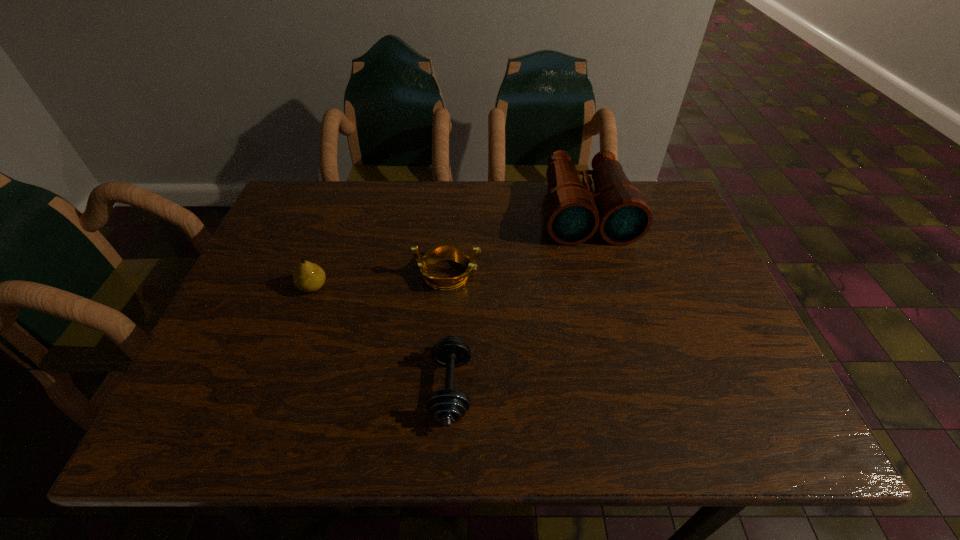
Where is `object that is at the far edge`? This screenshot has height=540, width=960. object that is at the far edge is located at coordinates (573, 213).

Image resolution: width=960 pixels, height=540 pixels. Identify the location of object at the near edge. (448, 406).

Locate an element on the screen. The width and height of the screenshot is (960, 540). object at the left edge is located at coordinates (308, 277).

Identify the location of object situated at the right edge. This screenshot has width=960, height=540. (573, 213).

What are the coordinates of `object located in the far right corner section of the desktop` in the screenshot? It's located at (573, 213).

The image size is (960, 540). Identify the location of vacant position at the far edge of the desktop. (x=437, y=210).

The width and height of the screenshot is (960, 540). Identify the location of vacant space at the near edge of the desktop. (385, 431).

Where is `free region at the left edge`? free region at the left edge is located at coordinates (303, 244).

Locate an element on the screen. free space at the right edge of the desktop is located at coordinates (666, 276).

Locate an element on the screen. This screenshot has width=960, height=540. vacant region at the near left corner of the desktop is located at coordinates (212, 444).